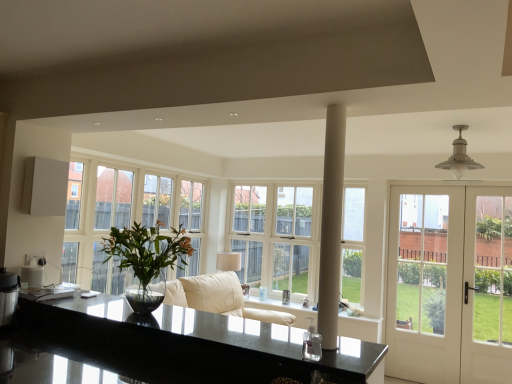
Question: Can you confirm if white smooth column at center is wider than black granite countertop at center?

Choices:
 (A) yes
 (B) no

Answer: (B)

Question: Is white smooth column at center oriented towards black granite countertop at center?

Choices:
 (A) yes
 (B) no

Answer: (B)

Question: Is white smooth column at center surrounding black granite countertop at center?

Choices:
 (A) no
 (B) yes

Answer: (A)

Question: Is white smooth column at center closer to the viewer compared to black granite countertop at center?

Choices:
 (A) yes
 (B) no

Answer: (B)

Question: Is white smooth column at center placed right next to black granite countertop at center?

Choices:
 (A) yes
 (B) no

Answer: (B)

Question: From a real-world perspective, is green glossy vase at left positioned above or below white glass window at center?

Choices:
 (A) below
 (B) above

Answer: (A)

Question: Is green glossy vase at left wider or thinner than white glass window at center?

Choices:
 (A) thin
 (B) wide

Answer: (B)

Question: Based on their positions, is green glossy vase at left located to the left or right of white glass window at center?

Choices:
 (A) left
 (B) right

Answer: (A)

Question: From the image's perspective, is green glossy vase at left located above or below white glass window at center?

Choices:
 (A) below
 (B) above

Answer: (B)

Question: In terms of size, does black granite countertop at center appear bigger or smaller than white glossy door at right?

Choices:
 (A) small
 (B) big

Answer: (A)

Question: Considering the positions of black granite countertop at center and white glossy door at right in the image, is black granite countertop at center taller or shorter than white glossy door at right?

Choices:
 (A) short
 (B) tall

Answer: (A)

Question: From a real-world perspective, relative to white glossy door at right, is black granite countertop at center vertically above or below?

Choices:
 (A) above
 (B) below

Answer: (B)

Question: Considering the positions of black granite countertop at center and white glossy door at right in the image, is black granite countertop at center wider or thinner than white glossy door at right?

Choices:
 (A) wide
 (B) thin

Answer: (A)

Question: Does point (484, 284) appear closer or farther from the camera than point (327, 221)?

Choices:
 (A) closer
 (B) farther

Answer: (B)

Question: Is white glossy door at right inside or outside of white smooth column at center?

Choices:
 (A) inside
 (B) outside

Answer: (B)